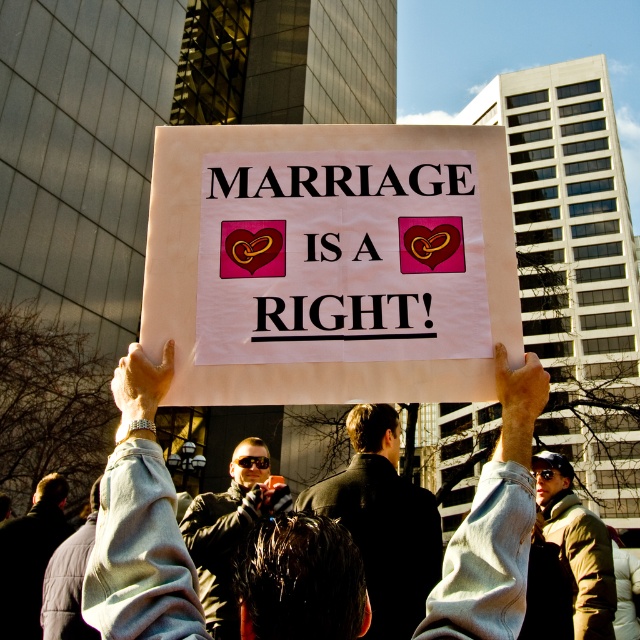
You are a photographer at the rally and want to capture the white paper sign at center clearly without the light gray sweatshirt at center blocking it. Based on their sizes, is this possible?

The white paper sign at center might be wider than the light gray sweatshirt at center, so there is a possibility that the sign can be captured without obstruction if positioned correctly.